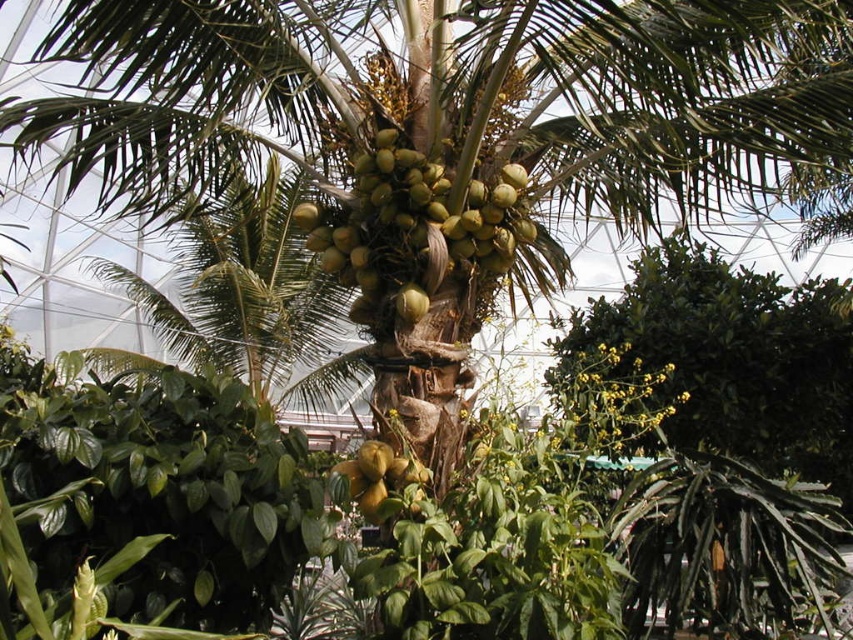
Question: Among these points, which one is farthest from the camera?

Choices:
 (A) (341, 248)
 (B) (375, 490)

Answer: (A)

Question: Can you confirm if green matte coconuts at center is positioned to the right of green matte coconut at center?

Choices:
 (A) no
 (B) yes

Answer: (B)

Question: Can you confirm if green matte coconuts at center is wider than green matte coconut at center?

Choices:
 (A) no
 (B) yes

Answer: (B)

Question: Considering the relative positions of green matte coconuts at center and green matte coconut at center in the image provided, where is green matte coconuts at center located with respect to green matte coconut at center?

Choices:
 (A) left
 (B) right

Answer: (B)

Question: Among these points, which one is farthest from the camera?

Choices:
 (A) (386, 477)
 (B) (515, 204)

Answer: (B)

Question: Which object appears farthest from the camera in this image?

Choices:
 (A) green matte coconuts at center
 (B) green matte coconut at center

Answer: (A)